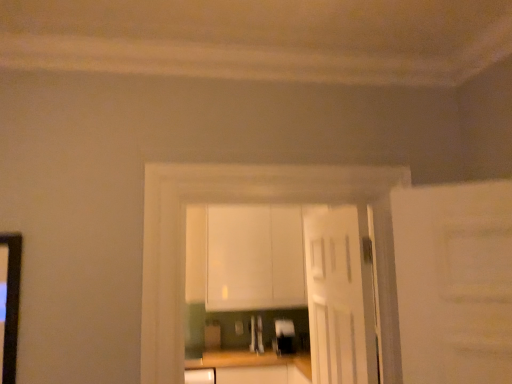
Question: Can you confirm if satin silver toaster at center, acting as the first appliance starting from the left, is thinner than white matte cabinet at center?

Choices:
 (A) no
 (B) yes

Answer: (B)

Question: From the image's perspective, is satin silver toaster at center, which appears as the second appliance when viewed from the right, beneath white matte cabinet at center?

Choices:
 (A) yes
 (B) no

Answer: (A)

Question: From a real-world perspective, is satin silver toaster at center, acting as the first appliance starting from the left, beneath white matte cabinet at center?

Choices:
 (A) no
 (B) yes

Answer: (B)

Question: Considering the relative positions of satin silver toaster at center, which appears as the second appliance when viewed from the right, and white matte cabinet at center in the image provided, is satin silver toaster at center, which appears as the second appliance when viewed from the right, to the right of white matte cabinet at center from the viewer's perspective?

Choices:
 (A) no
 (B) yes

Answer: (B)

Question: Is satin silver toaster at center, acting as the first appliance starting from the left, looking in the opposite direction of white matte cabinet at center?

Choices:
 (A) yes
 (B) no

Answer: (B)

Question: From their relative heights in the image, would you say wooden at center is taller or shorter than satin silver toaster at center, acting as the first appliance starting from the left?

Choices:
 (A) short
 (B) tall

Answer: (B)

Question: Is point (264, 354) closer or farther from the camera than point (258, 316)?

Choices:
 (A) closer
 (B) farther

Answer: (A)

Question: Considering the positions of wooden at center and satin silver toaster at center, acting as the first appliance starting from the left, in the image, is wooden at center wider or thinner than satin silver toaster at center, acting as the first appliance starting from the left,?

Choices:
 (A) thin
 (B) wide

Answer: (B)

Question: From the image's perspective, is wooden at center located above or below satin silver toaster at center, acting as the first appliance starting from the left?

Choices:
 (A) below
 (B) above

Answer: (A)

Question: From the image's perspective, relative to satin silver toaster at center, acting as the first appliance starting from the left, is white glossy cabinets at center above or below?

Choices:
 (A) below
 (B) above

Answer: (B)

Question: From a real-world perspective, is white glossy cabinets at center physically located above or below satin silver toaster at center, which appears as the second appliance when viewed from the right?

Choices:
 (A) above
 (B) below

Answer: (A)

Question: Is white glossy cabinets at center spatially inside satin silver toaster at center, which appears as the second appliance when viewed from the right, or outside of it?

Choices:
 (A) inside
 (B) outside

Answer: (B)

Question: Would you say white glossy cabinets at center is to the left or to the right of satin silver toaster at center, acting as the first appliance starting from the left, in the picture?

Choices:
 (A) left
 (B) right

Answer: (B)

Question: Is white matte cabinet at center bigger or smaller than satin silver toaster at center, which appears as the second appliance when viewed from the right?

Choices:
 (A) small
 (B) big

Answer: (B)

Question: From the image's perspective, relative to satin silver toaster at center, which appears as the second appliance when viewed from the right, is white matte cabinet at center above or below?

Choices:
 (A) above
 (B) below

Answer: (A)